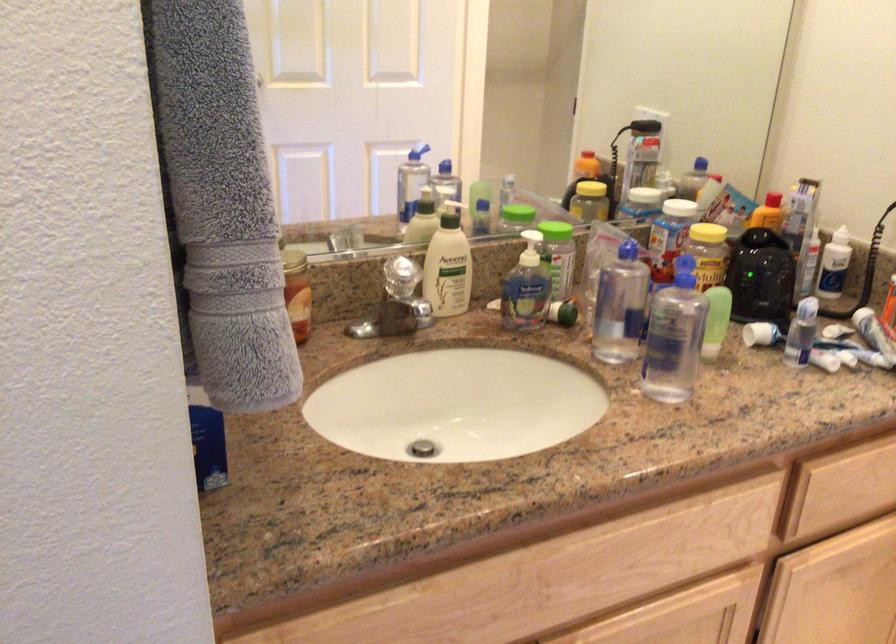
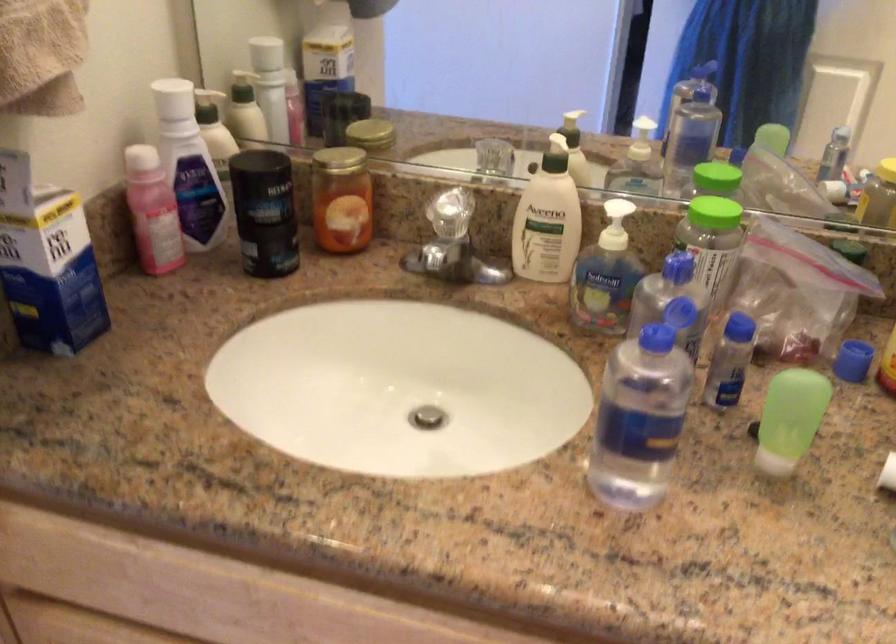
Question: The first image is from the beginning of the video and the second image is from the end. How did the camera likely rotate when shooting the video?

Choices:
 (A) Left
 (B) Right
 (C) Up
 (D) Down

Answer: (A)